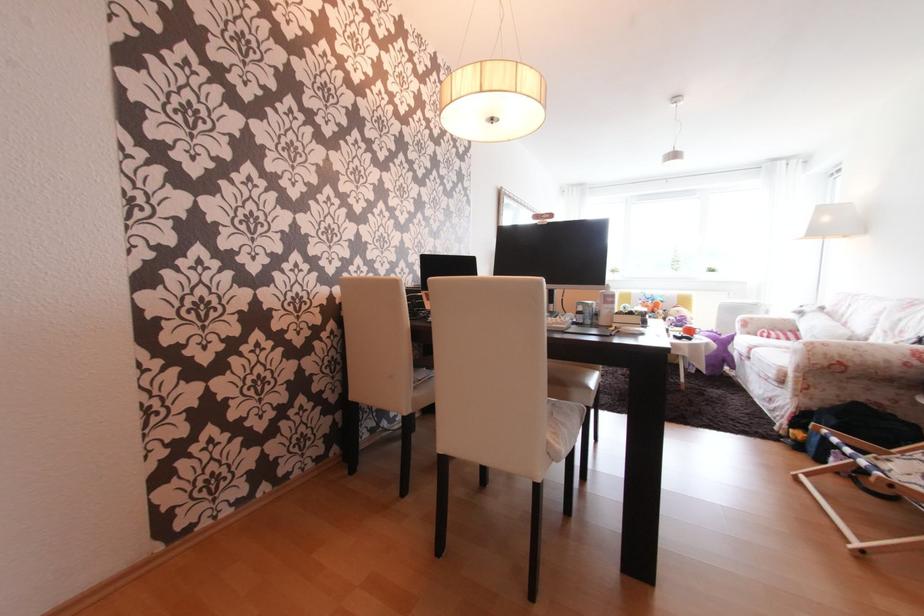
At what (x,y) coordinates should I click in order to perform the action: click on white pump head. Please return your answer as a coordinate pair (x, y). This screenshot has width=924, height=616. Looking at the image, I should click on (492, 100).